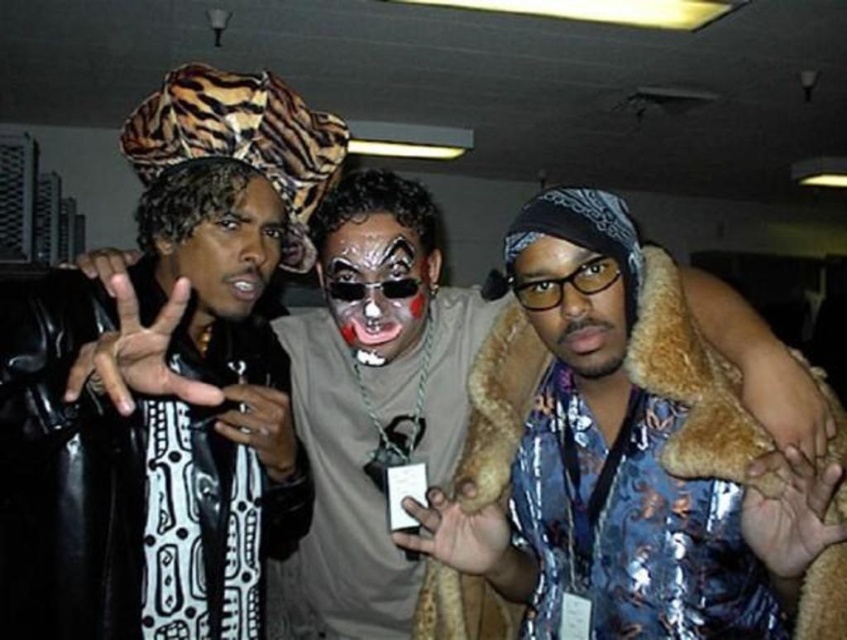
Does matte black face paint at center appear on the right side of matte black face at center?

Indeed, matte black face paint at center is positioned on the right side of matte black face at center.

What do you see at coordinates (377, 284) in the screenshot?
I see `matte black face paint at center` at bounding box center [377, 284].

Who is more forward, (418, 241) or (194, 227)?

Point (194, 227)

Where is `matte black face paint at center`? This screenshot has width=847, height=640. matte black face paint at center is located at coordinates (377, 284).

Does leather jacket at center appear on the left side of matte black face at center?

Incorrect, leather jacket at center is not on the left side of matte black face at center.

Is point (318, 528) positioned behind point (189, 284)?

That is True.

Describe the element at coordinates (690, 336) in the screenshot. I see `leather jacket at center` at that location.

Where is `leather jacket at center`? The height and width of the screenshot is (640, 847). leather jacket at center is located at coordinates click(x=690, y=336).

Is leather jacket at center taller than black leather jacket at left?

Correct, leather jacket at center is much taller as black leather jacket at left.

Is point (303, 371) closer to camera compared to point (39, 540)?

No, (303, 371) is further to viewer.

What do you see at coordinates (690, 336) in the screenshot? The image size is (847, 640). I see `leather jacket at center` at bounding box center [690, 336].

Identify the location of leather jacket at center. This screenshot has width=847, height=640. (690, 336).